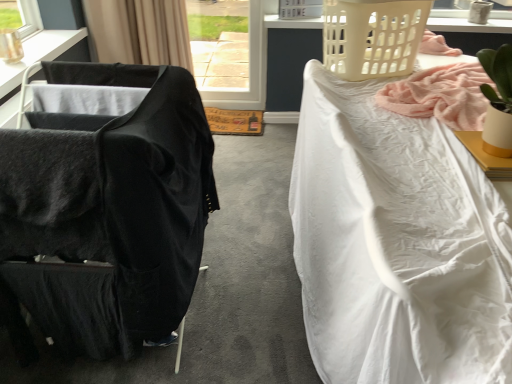
Question: In the image, is white ceramic lamp at upper right, the second lamp in the front-to-back sequence, positioned in front of or behind beige plastic laundry basket at upper right, which appears as the first basket when ordered from the bottom?

Choices:
 (A) behind
 (B) front

Answer: (A)

Question: Is point (484, 18) positioned closer to the camera than point (343, 46)?

Choices:
 (A) closer
 (B) farther

Answer: (B)

Question: Which object is the closest to the black fabric curtain at upper left?

Choices:
 (A) white plastic laundry basket at upper center, the second basket from the front
 (B) black fabric chair at left
 (C) white matte desk at upper right
 (D) black fabric table at left
 (E) beige plastic laundry basket at upper right, the 1th basket from the front

Answer: (D)

Question: Which object is positioned farthest from the white textured fabric at right?

Choices:
 (A) black fabric table at left
 (B) white plastic laundry basket at upper center, the first basket in the top-to-bottom sequence
 (C) beige plastic laundry basket at upper right, the 1th basket from the front
 (D) metallic gold lamp at upper left, the first lamp viewed from the front
 (E) white ceramic lamp at upper right, the second lamp in the front-to-back sequence

Answer: (E)